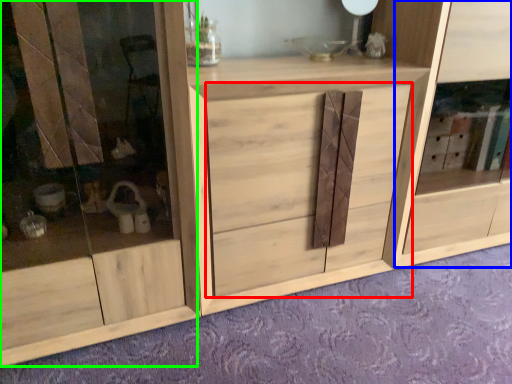
Question: Which object is the closest to the drawer (highlighted by a red box)? Choose among these: cabinet (highlighted by a blue box) or screen door (highlighted by a green box).

Choices:
 (A) cabinet
 (B) screen door

Answer: (B)